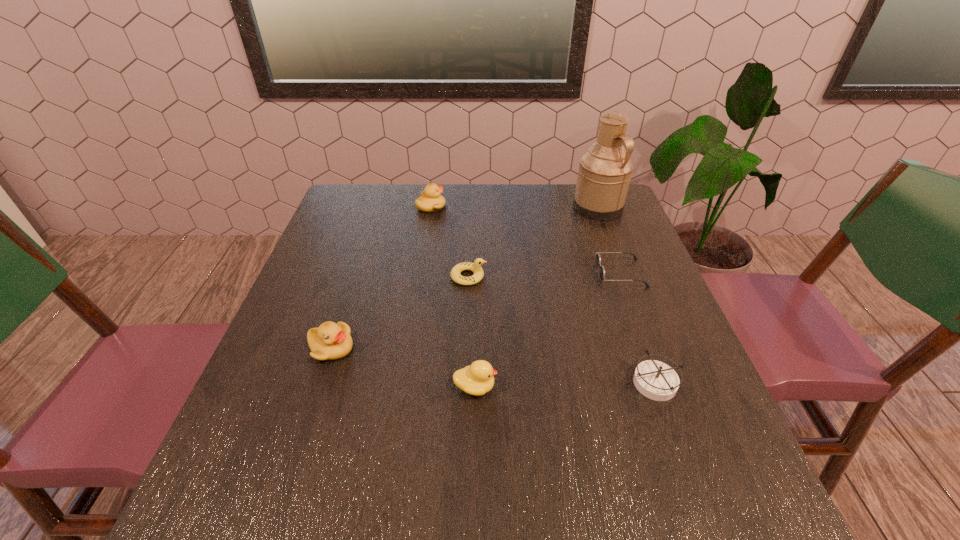
Identify the location of the tallest object. The height and width of the screenshot is (540, 960). (604, 173).

Where is `the farthest duckling`? The height and width of the screenshot is (540, 960). the farthest duckling is located at coordinates (430, 200).

Identify the location of the second object from left to right. (430, 200).

The width and height of the screenshot is (960, 540). Identify the location of the third farthest duckling. (330, 341).

You are a GUI agent. You are given a task and a screenshot of the screen. Output one action in this format:
    pyautogui.click(x=<x>, y=<y>)
    Task: Click on the leftmost object
    This screenshot has width=960, height=540.
    Given the screenshot: What is the action you would take?
    pyautogui.click(x=330, y=341)

This screenshot has height=540, width=960. What are the coordinates of `the nearest duckling` in the screenshot? It's located at (477, 379).

Find the location of a particular element. This screenshot has height=540, width=960. compass is located at coordinates (655, 380).

You are a GUI agent. You are given a task and a screenshot of the screen. Output one action in this format:
    pyautogui.click(x=<x>, y=<y>)
    Task: Click on the shortest duckling
    The width and height of the screenshot is (960, 540).
    Given the screenshot: What is the action you would take?
    pyautogui.click(x=476, y=267)

Locate an element on the screen. Image resolution: width=960 pixels, height=540 pixels. sunglasses is located at coordinates (598, 258).

I want to click on free space located on the left of the pitcher, so click(511, 207).